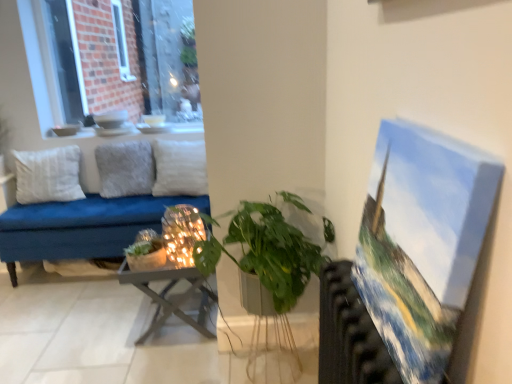
Question: Do you think white ceramic vase at upper center is within metallic radiator at right, or outside of it?

Choices:
 (A) inside
 (B) outside

Answer: (B)

Question: From a real-world perspective, is white ceramic vase at upper center physically located above or below metallic radiator at right?

Choices:
 (A) below
 (B) above

Answer: (B)

Question: Which object is positioned closest to the green matte plant at center, marked as the second houseplant in a right-to-left arrangement?

Choices:
 (A) green matte plant at center, the 2th houseplant when ordered from left to right
 (B) brick wall at upper left
 (C) metallic radiator at right
 (D) metallic gray table at center
 (E) oil paint canvas at right

Answer: (D)

Question: Estimate the real-world distances between objects in this image. Which object is closer to the white cotton pillow at left, acting as the 3th pillow starting from the right?

Choices:
 (A) iridescent glass candle holder at center
 (B) oil paint canvas at right
 (C) metallic radiator at right
 (D) white soft pillow at center, the third pillow viewed from the left
 (E) green matte plant at center, which is counted as the second houseplant, starting from the back

Answer: (D)